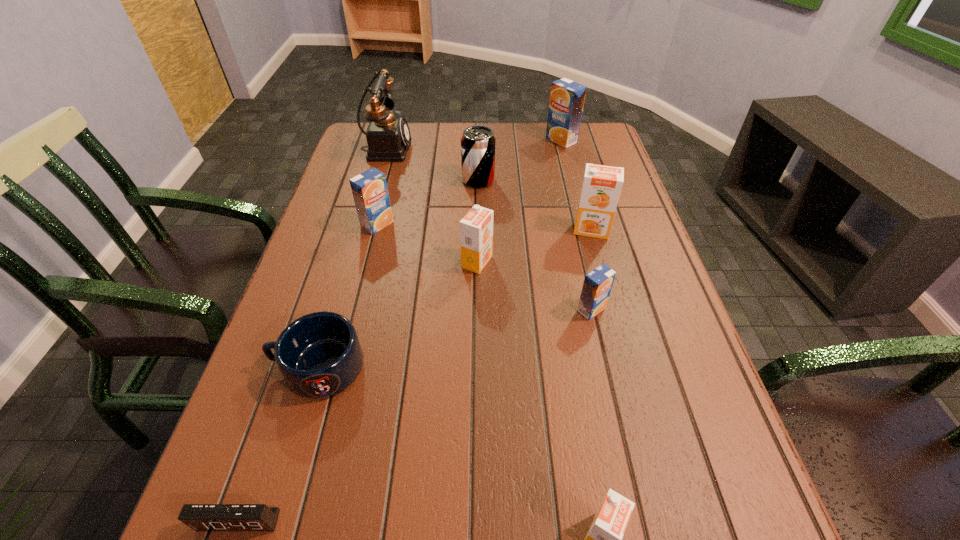
Choose which orange juice is the fourth nearest neighbor to the leftmost orange juice. Please provide its 2D coordinates. Your answer should be formatted as a tuple, i.e. [(x, y)], where the tuple contains the x and y coordinates of a point satisfying the conditions above.

[(567, 97)]

Locate which orange juice is the fourth closest to the fifth nearest object. Please provide its 2D coordinates. Your answer should be formatted as a tuple, i.e. [(x, y)], where the tuple contains the x and y coordinates of a point satisfying the conditions above.

[(567, 97)]

The image size is (960, 540). I want to click on the second closest blue orange_juice relative to the third nearest object, so click(598, 283).

The width and height of the screenshot is (960, 540). Identify the location of blue orange_juice that is the second closest to the shortest object. (370, 192).

Choose which orange orange juice is the second nearest neighbor to the seventh farthest object. Please provide its 2D coordinates. Your answer should be formatted as a tuple, i.e. [(x, y)], where the tuple contains the x and y coordinates of a point satisfying the conditions above.

[(601, 188)]

The height and width of the screenshot is (540, 960). In order to click on the closest orange orange juice to the rightmost orange orange juice in this screenshot , I will do `click(476, 228)`.